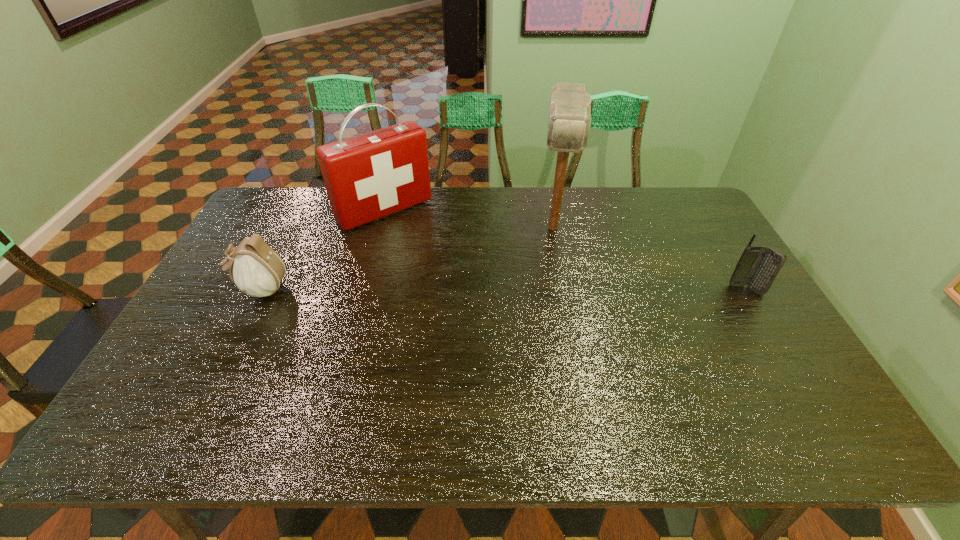
The image size is (960, 540). In order to click on vacant position at the right edge of the desktop in this screenshot , I will do `click(697, 268)`.

Find the location of `vacant area at the far left corner of the desktop`. vacant area at the far left corner of the desktop is located at coordinates (272, 192).

Identify the location of vacant space that's between the mallet and the pouch. The height and width of the screenshot is (540, 960). (407, 258).

Image resolution: width=960 pixels, height=540 pixels. In order to click on empty location between the cellular telephone and the mallet in this screenshot , I will do `click(649, 259)`.

Where is `blank region between the cellular telephone and the third object from left to right`? The width and height of the screenshot is (960, 540). blank region between the cellular telephone and the third object from left to right is located at coordinates (649, 259).

You are a GUI agent. You are given a task and a screenshot of the screen. Output one action in this format:
    pyautogui.click(x=<x>, y=<y>)
    Task: Click on the blank region between the third object from right to left and the mallet
    This screenshot has width=960, height=540.
    Given the screenshot: What is the action you would take?
    pyautogui.click(x=468, y=219)

Image resolution: width=960 pixels, height=540 pixels. I want to click on free area in between the rightmost object and the third shortest object, so click(x=565, y=250).

Identify the location of vacant area that lies between the rightmost object and the second object from left to right. (565, 250).

At what (x,y) coordinates should I click in order to perform the action: click on vacant area that lies between the mallet and the first-aid kit. Please return your answer as a coordinate pair (x, y). This screenshot has height=540, width=960. Looking at the image, I should click on (468, 219).

You are a GUI agent. You are given a task and a screenshot of the screen. Output one action in this format:
    pyautogui.click(x=<x>, y=<y>)
    Task: Click on the free spot between the cellular telephone and the mallet
    
    Given the screenshot: What is the action you would take?
    pyautogui.click(x=649, y=259)